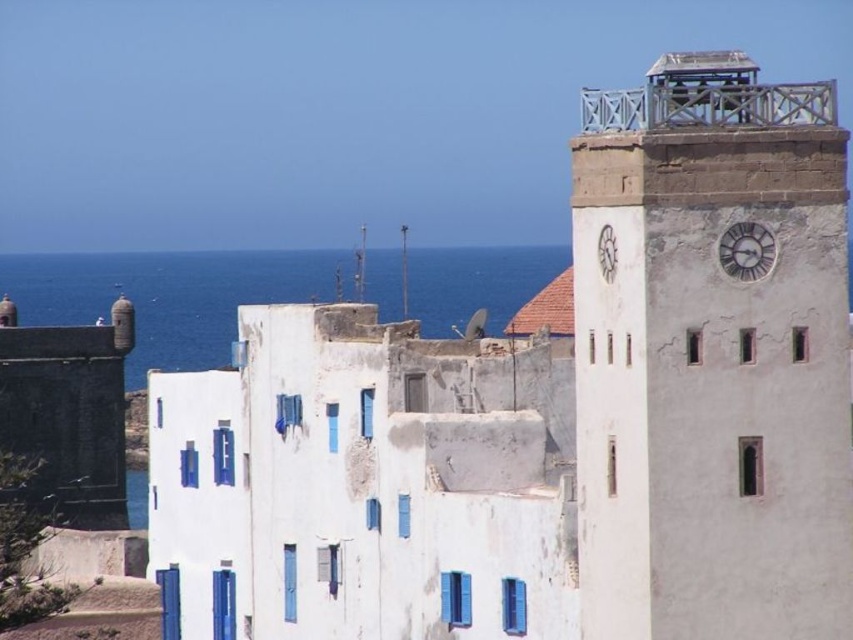
Question: Does blue water at left have a lesser width compared to white matte clock at upper right?

Choices:
 (A) no
 (B) yes

Answer: (A)

Question: Which object is the closest to the white matte clock at upper right?

Choices:
 (A) silver metallic clock at upper right
 (B) blue water at left

Answer: (A)

Question: Which point is farther to the camera?

Choices:
 (A) (746, 272)
 (B) (257, 291)
 (C) (616, 198)

Answer: (B)

Question: Is blue water at left above white matte clock at upper right?

Choices:
 (A) yes
 (B) no

Answer: (B)

Question: Is the position of light brown stone clock tower at upper right more distant than that of white matte clock at upper right?

Choices:
 (A) yes
 (B) no

Answer: (B)

Question: Which point is closer to the camera?

Choices:
 (A) silver metallic clock at upper right
 (B) blue water at left
 (C) white matte clock at upper right

Answer: (A)